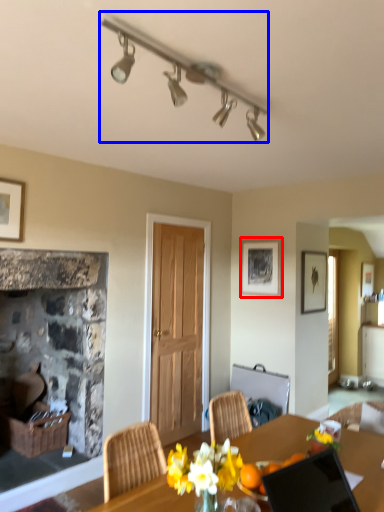
Question: Among these objects, which one is nearest to the camera, picture frame (highlighted by a red box) or lamp (highlighted by a blue box)?

Choices:
 (A) picture frame
 (B) lamp

Answer: (B)